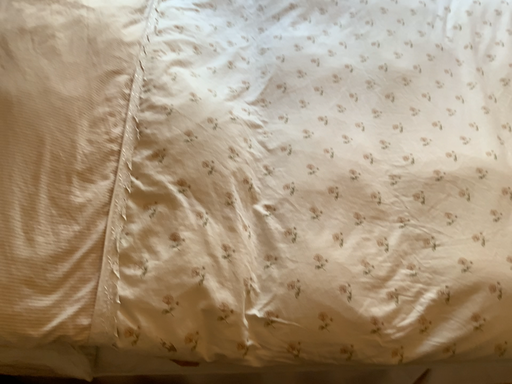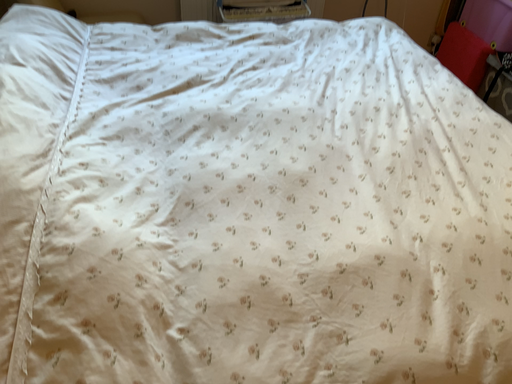
Question: How did the camera likely rotate when shooting the video?

Choices:
 (A) rotated upward
 (B) rotated downward

Answer: (A)